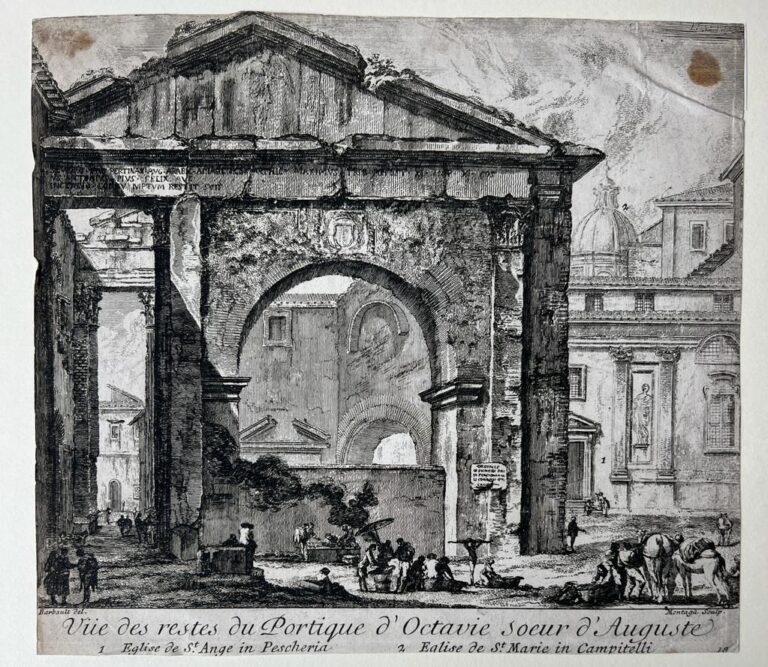
The height and width of the screenshot is (667, 768). Identify the location of windows. (702, 233), (725, 231), (641, 301), (594, 305), (576, 384), (717, 427), (277, 331).